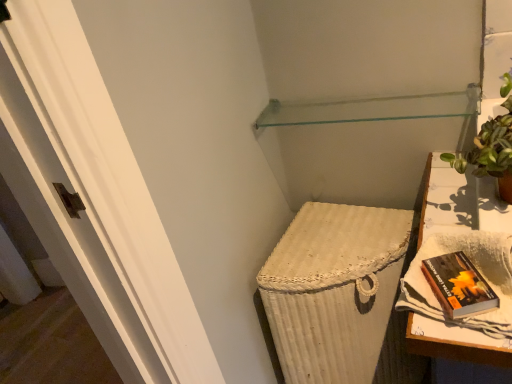
Question: Is hardcover book at right bigger than green leafy plant in terracotta pot at upper right?

Choices:
 (A) no
 (B) yes

Answer: (A)

Question: Does hardcover book at right have a smaller size compared to green leafy plant in terracotta pot at upper right?

Choices:
 (A) yes
 (B) no

Answer: (A)

Question: From a real-world perspective, is hardcover book at right on top of green leafy plant in terracotta pot at upper right?

Choices:
 (A) yes
 (B) no

Answer: (B)

Question: Is hardcover book at right completely or partially outside of green leafy plant in terracotta pot at upper right?

Choices:
 (A) no
 (B) yes

Answer: (B)

Question: Considering the relative positions of hardcover book at right and green leafy plant in terracotta pot at upper right in the image provided, is hardcover book at right behind green leafy plant in terracotta pot at upper right?

Choices:
 (A) no
 (B) yes

Answer: (A)

Question: From a real-world perspective, is transparent glass shelf at upper center above or below white woven table at right?

Choices:
 (A) below
 (B) above

Answer: (B)

Question: From the image's perspective, is transparent glass shelf at upper center located above or below white woven table at right?

Choices:
 (A) above
 (B) below

Answer: (A)

Question: Is transparent glass shelf at upper center taller or shorter than white woven table at right?

Choices:
 (A) tall
 (B) short

Answer: (B)

Question: In terms of size, does transparent glass shelf at upper center appear bigger or smaller than white woven table at right?

Choices:
 (A) small
 (B) big

Answer: (A)

Question: Which is correct: green leafy plant in terracotta pot at upper right is inside transparent glass shelf at upper center, or outside of it?

Choices:
 (A) outside
 (B) inside

Answer: (A)

Question: Considering the positions of point (506, 195) and point (439, 102), is point (506, 195) closer or farther from the camera than point (439, 102)?

Choices:
 (A) farther
 (B) closer

Answer: (B)

Question: Considering the positions of green leafy plant in terracotta pot at upper right and transparent glass shelf at upper center in the image, is green leafy plant in terracotta pot at upper right bigger or smaller than transparent glass shelf at upper center?

Choices:
 (A) small
 (B) big

Answer: (B)

Question: Looking at their shapes, would you say green leafy plant in terracotta pot at upper right is wider or thinner than transparent glass shelf at upper center?

Choices:
 (A) wide
 (B) thin

Answer: (A)

Question: Looking at the image, does hardcover book at right seem bigger or smaller compared to transparent glass shelf at upper center?

Choices:
 (A) small
 (B) big

Answer: (A)

Question: Is hardcover book at right inside the boundaries of transparent glass shelf at upper center, or outside?

Choices:
 (A) outside
 (B) inside

Answer: (A)